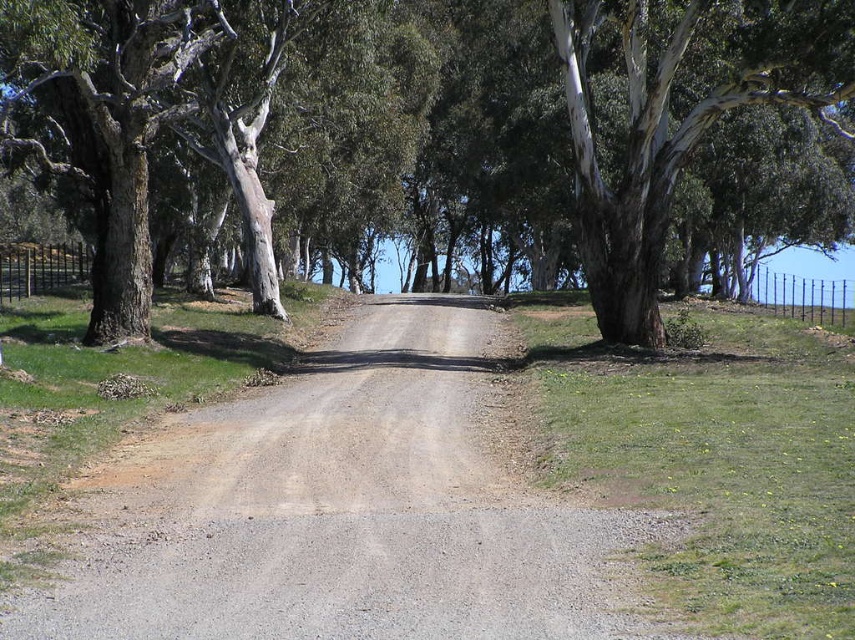
Which is below, white bark tree at center or gray gravel road at center?

Positioned lower is gray gravel road at center.

Who is positioned more to the left, white bark tree at center or gray gravel road at center?

From the viewer's perspective, gray gravel road at center appears more on the left side.

The width and height of the screenshot is (855, 640). What do you see at coordinates (413, 125) in the screenshot?
I see `white bark tree at center` at bounding box center [413, 125].

Where is `white bark tree at center`? white bark tree at center is located at coordinates (413, 125).